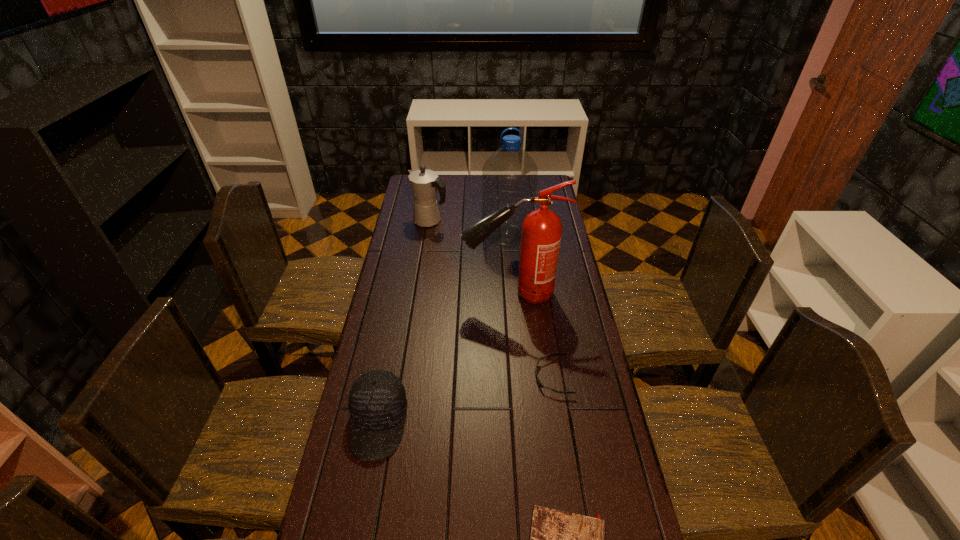
The width and height of the screenshot is (960, 540). Identify the location of water jug. (509, 175).

This screenshot has height=540, width=960. I want to click on the fourth nearest object, so pyautogui.click(x=541, y=233).

You are a GUI agent. You are given a task and a screenshot of the screen. Output one action in this format:
    pyautogui.click(x=<x>, y=<y>)
    Task: Click on the coffeepot
    
    Given the screenshot: What is the action you would take?
    pyautogui.click(x=424, y=182)

The width and height of the screenshot is (960, 540). Identify the location of baseball cap. (377, 401).

At what (x,y) coordinates should I click in order to perform the action: click on sunglasses. Please return your answer as a coordinate pair (x, y). The width and height of the screenshot is (960, 540). Looking at the image, I should click on (538, 381).

At what (x,y) coordinates should I click in order to perform the action: click on vacant space located on the left of the water jug. Please return your answer as a coordinate pair (x, y). This screenshot has height=540, width=960. Looking at the image, I should click on (438, 236).

Identify the location of free spot located at the nozzle end of the third farthest object. (423, 294).

You are a GUI agent. You are given a task and a screenshot of the screen. Output one action in this format:
    pyautogui.click(x=<x>, y=<y>)
    Task: Click on the free space located at the nozzle end of the third farthest object
    The width and height of the screenshot is (960, 540).
    Given the screenshot: What is the action you would take?
    pyautogui.click(x=393, y=294)

This screenshot has height=540, width=960. In order to click on vacant space situated 0.100m at the nozzle end of the third farthest object in this screenshot , I will do `click(437, 294)`.

Where is `vacant area situated 0.190m on the front of the coffeepot`? vacant area situated 0.190m on the front of the coffeepot is located at coordinates (424, 256).